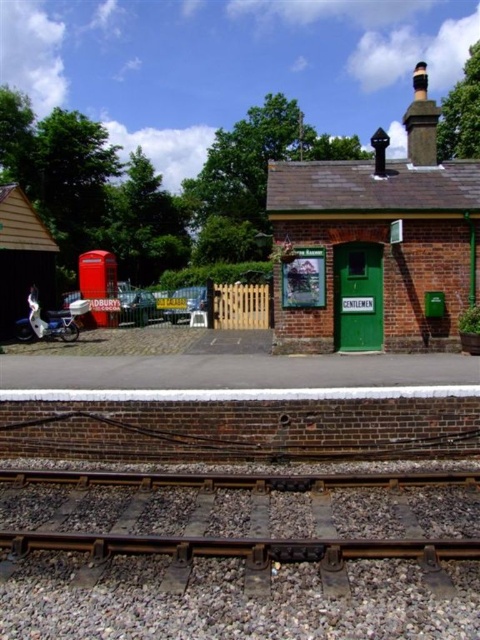
You are a photographer wanting to capture both the dark brown metal train track at bottom and the green painted brick building at upper right in a single shot. Based on their positions, which object should you focus on first to ensure both are in frame?

The dark brown metal train track at bottom is positioned under the green painted brick building at upper right, so focusing on the building first will allow the track to be captured below it in the same frame.